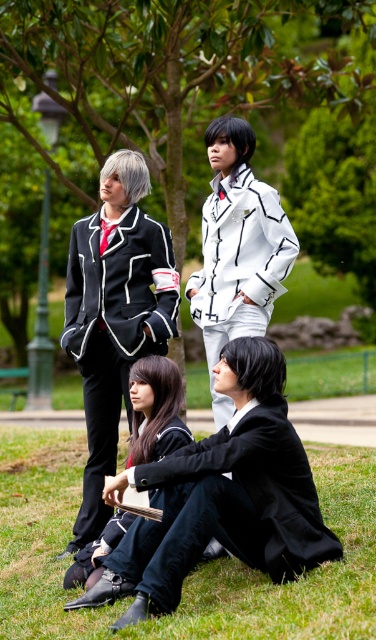
Who is positioned more to the left, matte black suit at left or white matte jacket at center?

From the viewer's perspective, matte black suit at left appears more on the left side.

Does matte black suit at left have a lesser height compared to white matte jacket at center?

No, matte black suit at left is not shorter than white matte jacket at center.

Who is more distant from viewer, (x=94, y=212) or (x=254, y=243)?

The point (x=94, y=212) is more distant.

The image size is (376, 640). In order to click on matte black suit at left in this screenshot , I will do `click(115, 316)`.

Which is below, matte black suit at left or satin black dress at lower center?

Positioned lower is satin black dress at lower center.

Can you confirm if matte black suit at left is positioned above satin black dress at lower center?

Correct, matte black suit at left is located above satin black dress at lower center.

Describe the element at coordinates (115, 316) in the screenshot. This screenshot has width=376, height=640. I see `matte black suit at left` at that location.

Identify the location of matte black suit at left. [115, 316].

Can you confirm if green grass at lower center is smaller than matte black suit at left?

No.

How distant is green grass at lower center from matte black suit at left?

green grass at lower center and matte black suit at left are 6.99 feet apart.

Is point (119, 458) closer to viewer compared to point (74, 280)?

No, (119, 458) is behind (74, 280).

At what (x,y) coordinates should I click in order to perform the action: click on green grass at lower center. Please return your answer as a coordinate pair (x, y). Looking at the image, I should click on (192, 572).